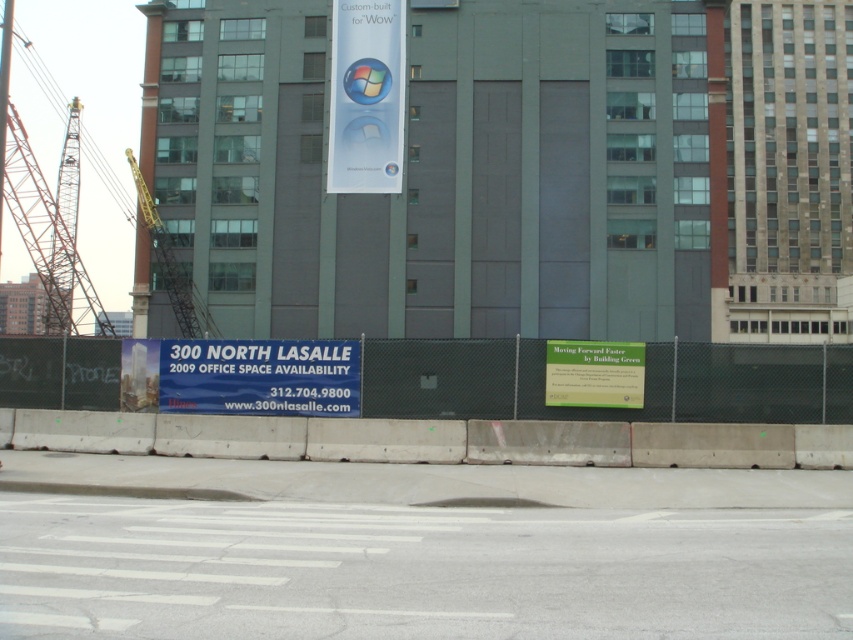
Who is lower down, green paper sign at center or yellow metallic crane at upper left?

green paper sign at center is lower down.

Is green paper sign at center above yellow metallic crane at upper left?

Actually, green paper sign at center is below yellow metallic crane at upper left.

Is point (621, 385) positioned behind point (126, 156)?

No, it is not.

Find the location of a particular element. green paper sign at center is located at coordinates (595, 372).

The height and width of the screenshot is (640, 853). Describe the element at coordinates (366, 97) in the screenshot. I see `blue glossy sphere at center` at that location.

Is point (329, 170) positioned in front of point (170, 248)?

Yes, it is in front of point (170, 248).

The image size is (853, 640). In order to click on blue glossy sphere at center in this screenshot , I will do `click(366, 97)`.

Who is higher up, blue glossy sphere at center or metallic gray crane at left?

Positioned higher is blue glossy sphere at center.

Consider the image. Is the position of blue glossy sphere at center more distant than that of metallic gray crane at left?

Yes.

Describe the element at coordinates (366, 97) in the screenshot. I see `blue glossy sphere at center` at that location.

The width and height of the screenshot is (853, 640). What are the coordinates of `blue glossy sphere at center` in the screenshot? It's located at (366, 97).